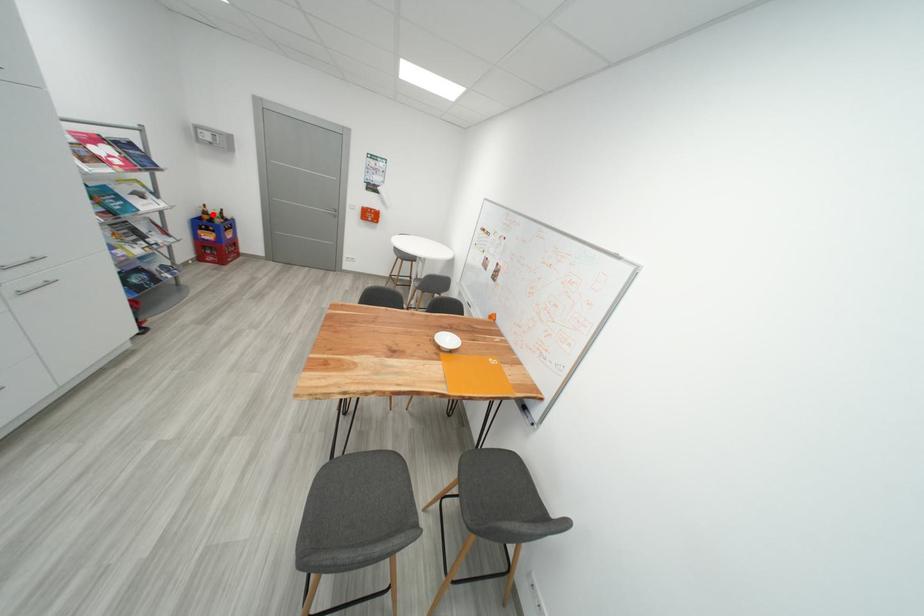
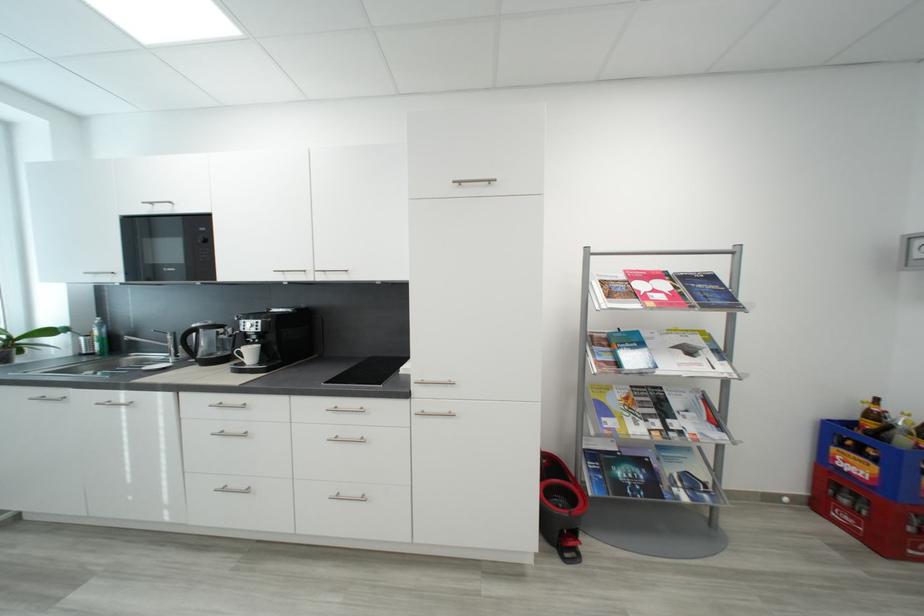
Find the pixel in the second image that matches the highlighted location in the first image.

(881, 418)